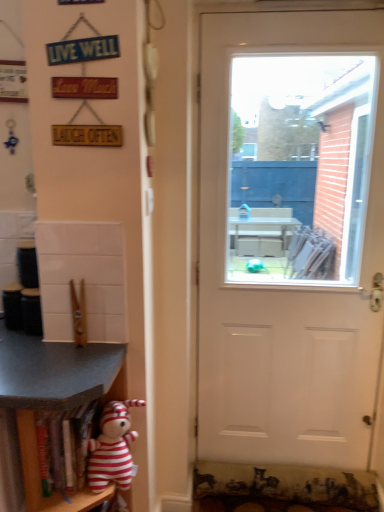
Question: Is striped plush toy at lower left at the right side of white matte door at center?

Choices:
 (A) yes
 (B) no

Answer: (B)

Question: From a real-world perspective, is striped plush toy at lower left beneath white matte door at center?

Choices:
 (A) yes
 (B) no

Answer: (A)

Question: Would you say striped plush toy at lower left is outside white matte door at center?

Choices:
 (A) yes
 (B) no

Answer: (A)

Question: Can you confirm if striped plush toy at lower left is thinner than white matte door at center?

Choices:
 (A) yes
 (B) no

Answer: (B)

Question: Would you say striped plush toy at lower left is a long distance from white matte door at center?

Choices:
 (A) no
 (B) yes

Answer: (B)

Question: From the image's perspective, is striped plush toy at lower left over white matte door at center?

Choices:
 (A) no
 (B) yes

Answer: (A)

Question: Would you say wooden shelf at lower left, the second shelf from the right, contains white matte door at center?

Choices:
 (A) yes
 (B) no

Answer: (B)

Question: Is wooden shelf at lower left, which appears as the 1th shelf when viewed from the left, positioned with its back to white matte door at center?

Choices:
 (A) no
 (B) yes

Answer: (A)

Question: Is wooden shelf at lower left, which appears as the 1th shelf when viewed from the left, not within white matte door at center?

Choices:
 (A) no
 (B) yes

Answer: (B)

Question: Is wooden shelf at lower left, the second shelf from the right, shorter than white matte door at center?

Choices:
 (A) yes
 (B) no

Answer: (A)

Question: Considering the relative positions of wooden shelf at lower left, which appears as the 1th shelf when viewed from the left, and white matte door at center in the image provided, is wooden shelf at lower left, which appears as the 1th shelf when viewed from the left, to the left of white matte door at center from the viewer's perspective?

Choices:
 (A) yes
 (B) no

Answer: (A)

Question: From the image's perspective, is wooden shelf at lower left, the second shelf from the right, under white matte door at center?

Choices:
 (A) no
 (B) yes

Answer: (B)

Question: Is wooden shelf at lower left, the second shelf from the right, completely or partially inside striped plush toy at lower left?

Choices:
 (A) no
 (B) yes

Answer: (A)